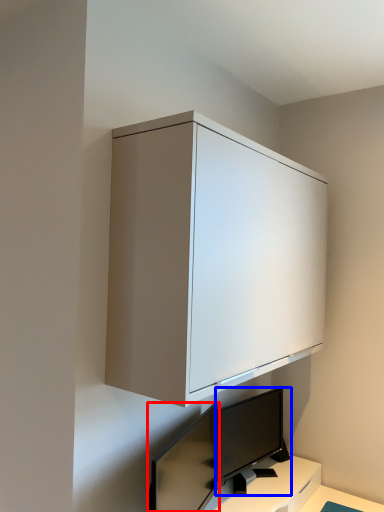
Question: Which point is further to the camera, computer monitor (highlighted by a red box) or computer monitor (highlighted by a blue box)?

Choices:
 (A) computer monitor
 (B) computer monitor

Answer: (B)